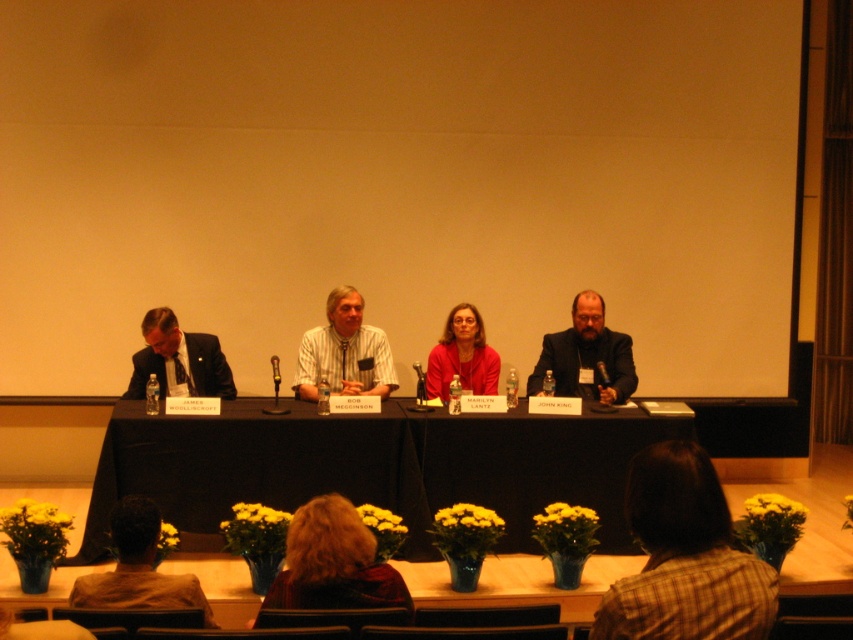
You are a photographer positioned behind the table at the panel discussion. You want to capture a closeup shot of the dark brown hair at lower center and the matte red blouse at center. Given that your camera has a maximum focus range of 2 meters, will you be able to capture both subjects in focus without moving the camera?

The dark brown hair at lower center is 2.72 meters from the matte red blouse at center. Since the distance between them exceeds the camera maximum focus range of 2 meters, you will not be able to capture both subjects in focus without moving the camera.

From the picture: You are organizing a charity event and need to seat two speakers based on their clothing width. The striped cotton shirt at center and the matte black suit at left are the two speakers. Which speaker should be seated in a narrower chair to accommodate their clothing?

The striped cotton shirt at center should be seated in the narrower chair since its width is less than the matte black suit at left.